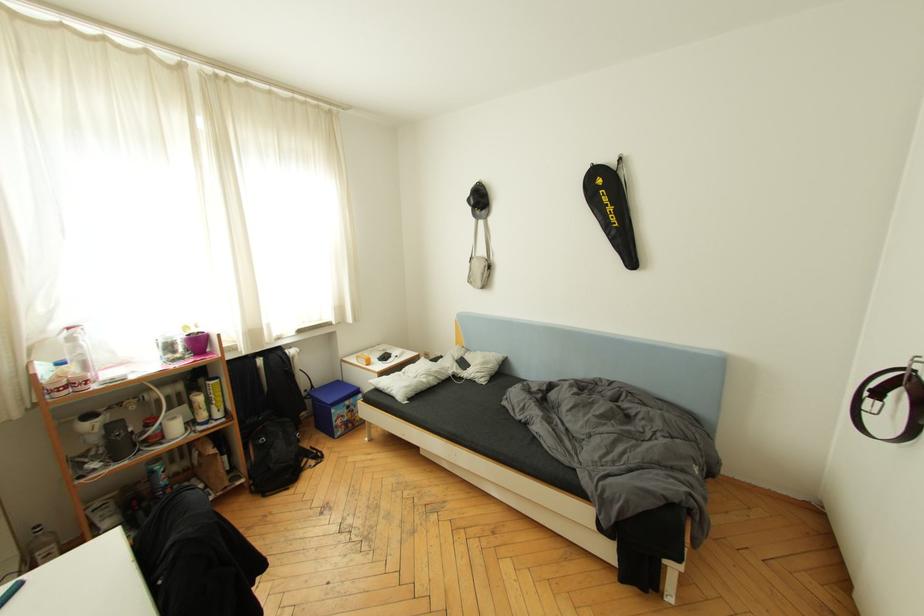
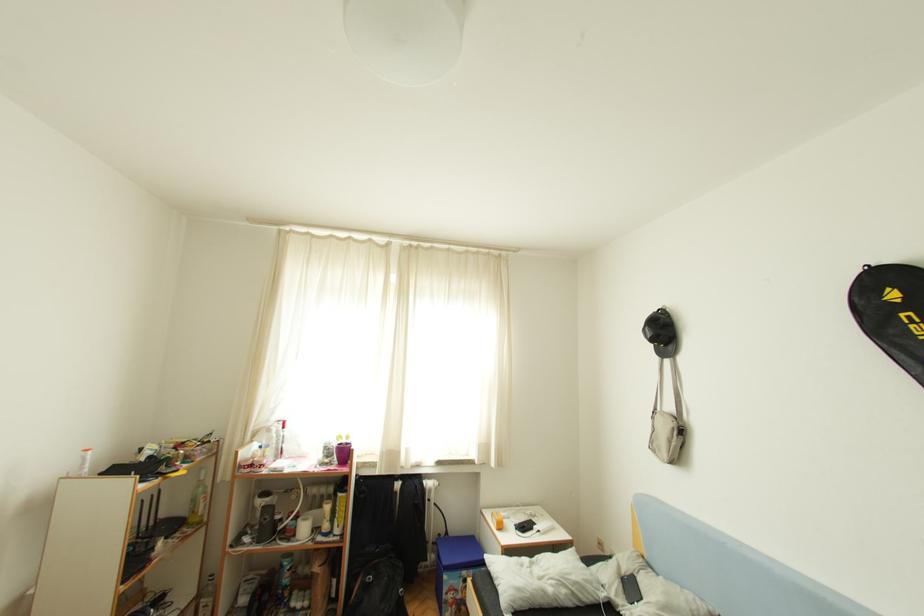
First-person continuous shooting, in which direction is the camera rotating?

The rotation direction of the camera is left-up.